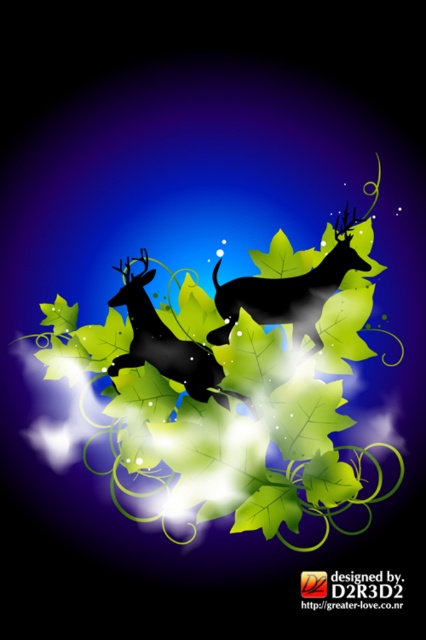
Question: Considering the relative positions of black matte/deer at center and black matte/deeply textured deer at center in the image provided, where is black matte/deer at center located with respect to black matte/deeply textured deer at center?

Choices:
 (A) left
 (B) right

Answer: (B)

Question: Which object appears farthest from the camera in this image?

Choices:
 (A) black matte/deer at center
 (B) black matte/deeply textured deer at center

Answer: (B)

Question: Which object is farther from the camera taking this photo?

Choices:
 (A) black matte deer at center
 (B) black matte/deeply textured deer at center
 (C) black matte/deer at center

Answer: (B)

Question: Can you confirm if black matte deer at center is bigger than black matte/deer at center?

Choices:
 (A) no
 (B) yes

Answer: (B)

Question: Estimate the real-world distances between objects in this image. Which object is closer to the black matte deer at center?

Choices:
 (A) black matte/deer at center
 (B) black matte/deeply textured deer at center

Answer: (B)

Question: Can you confirm if black matte/deer at center is bigger than black matte/deeply textured deer at center?

Choices:
 (A) yes
 (B) no

Answer: (A)